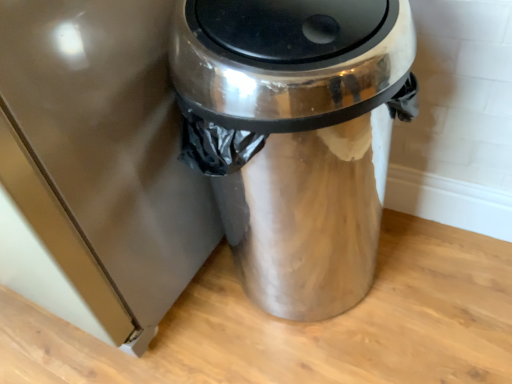
At what (x,y) coordinates should I click in order to perform the action: click on free region under polished stainless steel trash can at center (from a real-world perspective). Please return your answer as a coordinate pair (x, y). This screenshot has width=512, height=384. Looking at the image, I should click on (306, 294).